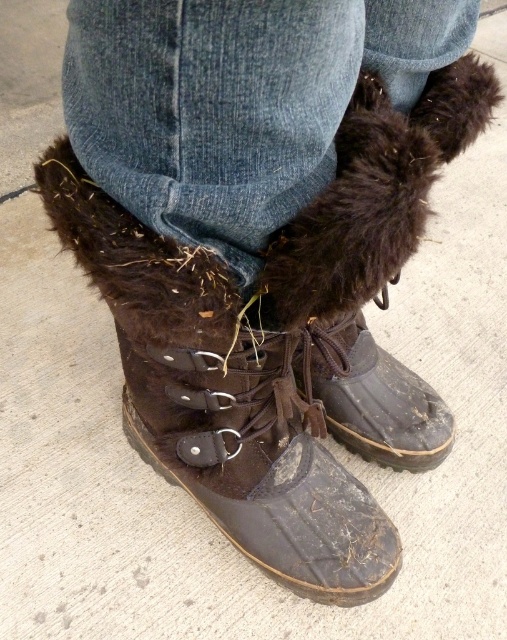
You are a fashion stylist preparing an outfit for a client. You have two boots in the image, a brown suede boot at center and a brown rubber boot at lower center. Which boot is positioned lower on the person?

The brown suede boot at center is located below the brown rubber boot at lower center, so the brown suede boot at center is positioned lower on the person.

Based on the photo, you are trying to decide which boot to wear based on the image. The scene shows a person wearing both a brown suede boot at center and a brown rubber boot at lower center. Which boot reaches higher up the leg?

The brown suede boot at center reaches higher up the leg than the brown rubber boot at lower center because it is taller.

In the scene shown: You are a photographer trying to capture a detailed shot of both the brown suede boot at center and the brown rubber boot at lower center. Which boot should you focus on first to ensure it appears sharp in the photo?

You should focus on the brown suede boot at center first because it is closer to the viewer than the brown rubber boot at lower center, so it requires proper focus to appear sharp.